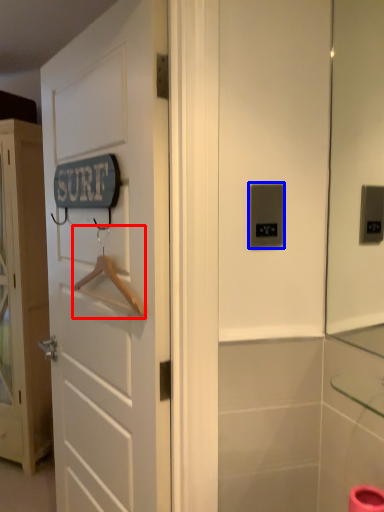
Question: Which object appears farthest to the camera in this image, hanger (highlighted by a red box) or light switch (highlighted by a blue box)?

Choices:
 (A) hanger
 (B) light switch

Answer: (A)